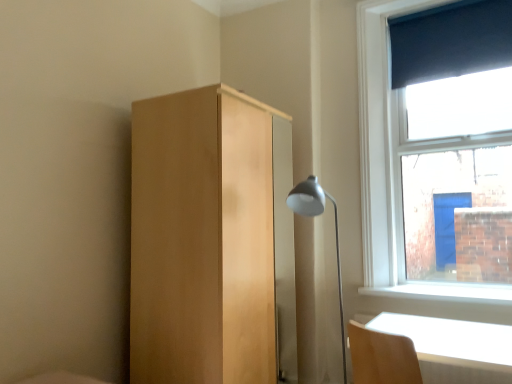
Image resolution: width=512 pixels, height=384 pixels. What are the coordinates of `free space above dark blue fabric at upper right (from a real-world perspective)` in the screenshot? It's located at (443, 6).